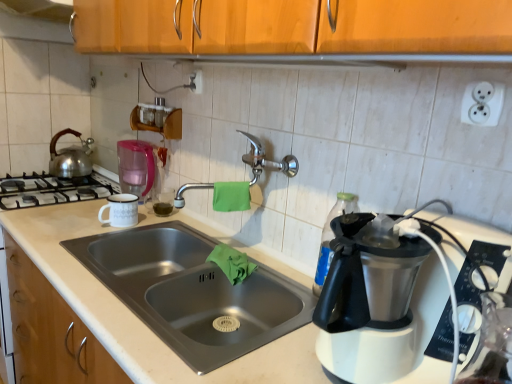
Locate an element on the screen. The width and height of the screenshot is (512, 384). white enamel mug at left is located at coordinates (121, 210).

Based on the photo, measure the distance between point (200, 306) and camera.

Point (200, 306) and camera are 4.14 feet apart.

What is the approximate height of stainless steel sink at center?

stainless steel sink at center is 7.54 inches in height.

Measure the distance between point (72,6) and camera.

The depth of point (72,6) is 6.09 feet.

Describe the element at coordinates (266, 160) in the screenshot. I see `satin nickel faucet at center` at that location.

Measure the distance between green matte liquid at sink and camera.

green matte liquid at sink is 1.68 meters from camera.

You are a GUI agent. You are given a task and a screenshot of the screen. Output one action in this format:
    pyautogui.click(x=<x>, y=<y>)
    Task: Click on the transparent plastic bottle at right
    The image size is (512, 384).
    Given the screenshot: What is the action you would take?
    pyautogui.click(x=331, y=237)

From a real-world perspective, which object rests below the other?

transparent plastic bottle at right.

Could you tell me if satin nickel faucet at center is turned towards transparent plastic bottle at right?

No, satin nickel faucet at center is not oriented towards transparent plastic bottle at right.

From the image's perspective, relative to transparent plastic bottle at right, is satin nickel faucet at center above or below?

From the image's perspective, satin nickel faucet at center appears above transparent plastic bottle at right.

Would you say satin nickel faucet at center contains wooden cabinet at upper center?

Definitely not — wooden cabinet at upper center is not inside satin nickel faucet at center.

Which is more to the right, satin nickel faucet at center or wooden cabinet at upper center?

satin nickel faucet at center is more to the right.

Where is `exhaust hood that is behind the satin nickel faucet at center`? exhaust hood that is behind the satin nickel faucet at center is located at coordinates (40, 9).

Which is nearer, (265, 166) or (42, 14)?

Positioned in front is point (265, 166).

Measure the distance from pink plastic blender at left to green cloth at sink, which is the 2th material from top to bottom.

pink plastic blender at left and green cloth at sink, which is the 2th material from top to bottom, are 27.05 inches apart from each other.

Can we say pink plastic blender at left lies outside green cloth at sink, which is the 2th material from top to bottom?

Yes, pink plastic blender at left is located beyond the bounds of green cloth at sink, which is the 2th material from top to bottom.

Which object is closer to the camera, pink plastic blender at left or green cloth at sink, which ranks as the first material in bottom-to-top order?

green cloth at sink, which ranks as the first material in bottom-to-top order.

From the image's perspective, which one is positioned higher, pink plastic blender at left or green cloth at sink, which is the 2th material from top to bottom?

From the image's view, pink plastic blender at left is above.

Is transparent plastic bottle at right wider or thinner than stainless steel sink at center?

Clearly, transparent plastic bottle at right has less width compared to stainless steel sink at center.

Looking at the image, does transparent plastic bottle at right seem bigger or smaller compared to stainless steel sink at center?

transparent plastic bottle at right is smaller than stainless steel sink at center.

In the image, is transparent plastic bottle at right on the left side or the right side of stainless steel sink at center?

transparent plastic bottle at right is to the right of stainless steel sink at center.

Does transparent plastic bottle at right have a greater height compared to stainless steel sink at center?

Indeed, transparent plastic bottle at right has a greater height compared to stainless steel sink at center.

How many degrees apart are the facing directions of silver metallic kettle at left and pink plastic blender at left?

0.00587 degrees separate the facing orientations of silver metallic kettle at left and pink plastic blender at left.

Does silver metallic kettle at left have a lesser height compared to pink plastic blender at left?

Indeed, silver metallic kettle at left has a lesser height compared to pink plastic blender at left.

From a real-world perspective, which is physically above, silver metallic kettle at left or pink plastic blender at left?

pink plastic blender at left.

Is silver metallic kettle at left aimed at pink plastic blender at left?

No, silver metallic kettle at left is not oriented towards pink plastic blender at left.

From the image's perspective, is white enamel mug at left on top of silver metallic kettle at left?

No, from the image's perspective, white enamel mug at left is not above silver metallic kettle at left.

From a real-world perspective, is white enamel mug at left located higher than silver metallic kettle at left?

No, from a real-world perspective, white enamel mug at left is not above silver metallic kettle at left.

How many degrees apart are the facing directions of white enamel mug at left and silver metallic kettle at left?

The angle between the facing direction of white enamel mug at left and the facing direction of silver metallic kettle at left is 0.00145 degrees.

How many degrees apart are the facing directions of white plastic electric outlet at upper right and pink plastic blender at left?

They differ by 0.00443 degrees in their facing directions.

Is white plastic electric outlet at upper right positioned with its back to pink plastic blender at left?

No, white plastic electric outlet at upper right is not facing the opposite direction of pink plastic blender at left.

Which object is more forward, white plastic electric outlet at upper right or pink plastic blender at left?

white plastic electric outlet at upper right is more forward.

Image resolution: width=512 pixels, height=384 pixels. What are the coordinates of `kitchen appliance beneath the white plastic electric outlet at upper right (from a real-world perspective)` in the screenshot? It's located at (135, 167).

Where is `tap lying above the transparent plastic bottle at right (from the image's perspective)`? tap lying above the transparent plastic bottle at right (from the image's perspective) is located at coordinates (266, 160).

Where is `tap lying in front of the wooden cabinet at upper center`? This screenshot has height=384, width=512. tap lying in front of the wooden cabinet at upper center is located at coordinates (266, 160).

Looking at the image, which one is located further to silver metallic kettle at left, green matte liquid at sink or green fabric towel at center, which is the 2th material from bottom to top?

Based on the image, green fabric towel at center, which is the 2th material from bottom to top, appears to be further to silver metallic kettle at left.

When comparing their distances from satin nickel faucet at center, does transparent plastic bottle at right or white enamel mug at left seem further?

The object further to satin nickel faucet at center is white enamel mug at left.

Which object lies nearer to the anchor point green matte liquid at sink, pink plastic blender at left or stainless steel sink at center?

The object closer to green matte liquid at sink is pink plastic blender at left.

Considering their positions, is green fabric towel at center, acting as the 1th material starting from the top, positioned further to green cloth at sink, which is the 2th material from top to bottom, than transparent plastic bottle at right?

transparent plastic bottle at right is further to green cloth at sink, which is the 2th material from top to bottom.

Considering their positions, is silver metallic kettle at left positioned further to green cloth at sink, which is the 2th material from top to bottom, than transparent plastic bottle at right?

silver metallic kettle at left lies further to green cloth at sink, which is the 2th material from top to bottom, than the other object.

When comparing their distances from green cloth at sink, which ranks as the first material in bottom-to-top order, does satin nickel faucet at center or wooden cabinet at upper center seem closer?

Based on the image, satin nickel faucet at center appears to be nearer to green cloth at sink, which ranks as the first material in bottom-to-top order.

Based on their spatial positions, is green matte liquid at sink or transparent plastic bottle at right further from wooden cabinet at upper center?

Based on the image, transparent plastic bottle at right appears to be further to wooden cabinet at upper center.

When comparing their distances from white enamel mug at left, does green matte liquid at sink or silver metallic kettle at left seem further?

silver metallic kettle at left is further to white enamel mug at left.

The height and width of the screenshot is (384, 512). What are the coordinates of `exhaust hood located between stainless steel sink at center and silver metallic kettle at left in the depth direction` in the screenshot? It's located at (40, 9).

Locate an element on the screen. Image resolution: width=512 pixels, height=384 pixels. mug between pink plastic blender at left and green fabric towel at center, acting as the 1th material starting from the top, from left to right is located at coordinates coord(121,210).

Locate an element on the screen. The image size is (512, 384). material between white enamel mug at left and green cloth at sink, which is the 2th material from top to bottom, in the horizontal direction is located at coordinates (231, 196).

The width and height of the screenshot is (512, 384). In order to click on mug between pink plastic blender at left and transparent plastic bottle at right in this screenshot , I will do `click(121, 210)`.